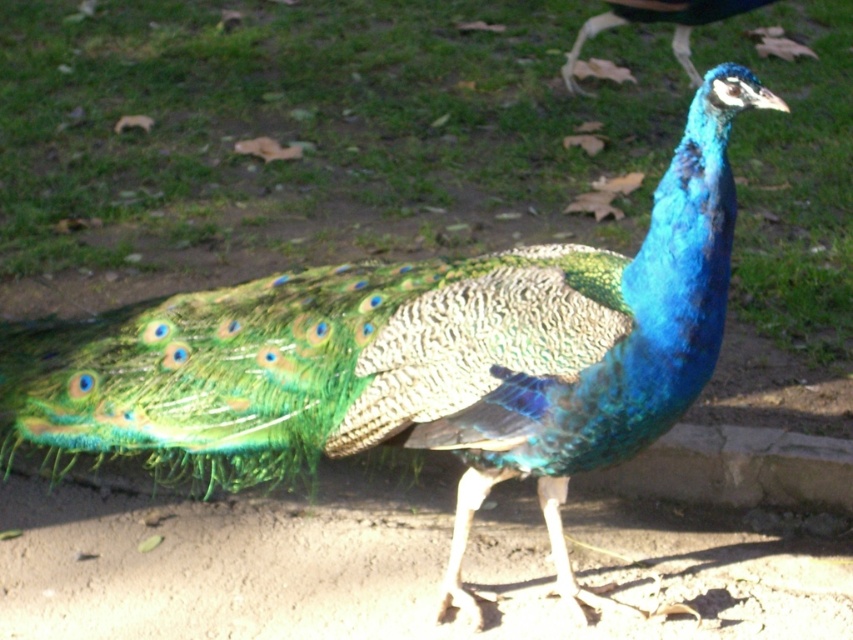
You are a small bird flying over the green textured grass at center and the blue iridescent feathers at upper center. Which object is taller?

The green textured grass at center is taller than the blue iridescent feathers at upper center.

You are a photographer trying to capture the peacock in the image. You want to ensure the green textured grass at center and the blue iridescent feathers at upper center are both in focus. Which object should you adjust your camera focus to first if you want to capture both areas clearly?

The blue iridescent feathers at upper center are closer to the camera than the green textured grass at center. To capture both areas clearly, you should focus on the blue iridescent feathers at upper center first, as it is the closer object, and then adjust for the green textured grass at center.

You are standing in the park and see the green textured grass at center and the blue iridescent feathers at upper center. Which object is located to the left of the other?

The green textured grass at center is positioned on the left side of blue iridescent feathers at upper center.